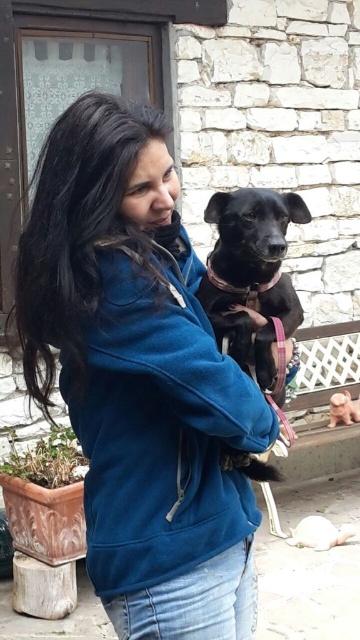
You are taking a photo of the woman and the black dog. You want to focus on the point that is closer to the camera. Which point should you choose between point [178,289] and point [263,196]?

You should choose point [178,289] because it is closer to the camera than point [263,196].

You are a photographer trying to capture a clear photo of the black matte dog at center. The blue fleece jacket at center is in the way. Can you estimate if the jacket is wide enough to block the entire dog from view?

The blue fleece jacket at center might be wider than black matte dog at center, so there is a possibility that the jacket could block the entire dog from view depending on their positions.